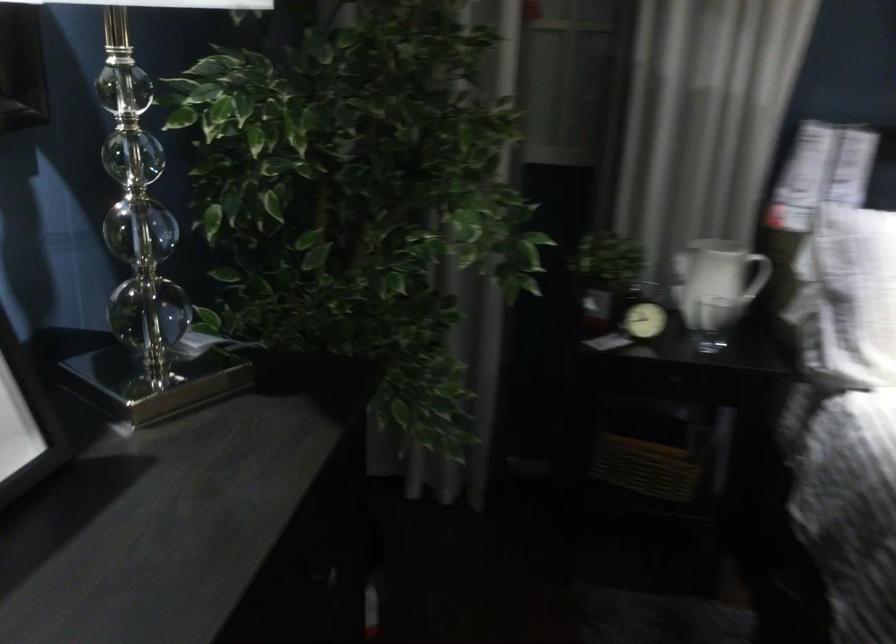
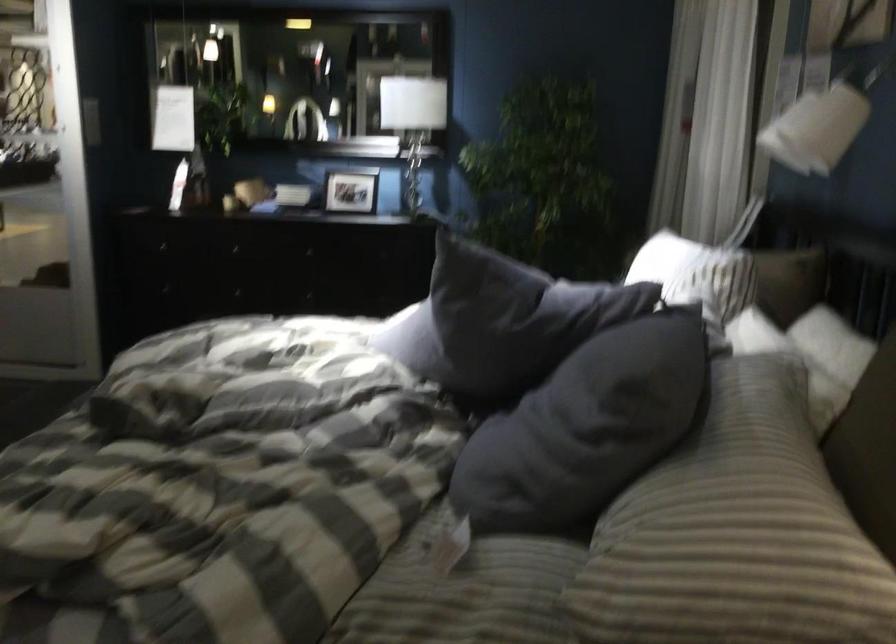
Question: I am providing you with two images of the same scene from different viewpoints. Please identify which objects are invisible in image2.

Choices:
 (A) wicker basket
 (B) red bottle cap
 (C) striped pillow
 (D) dark grey pillow

Answer: (A)